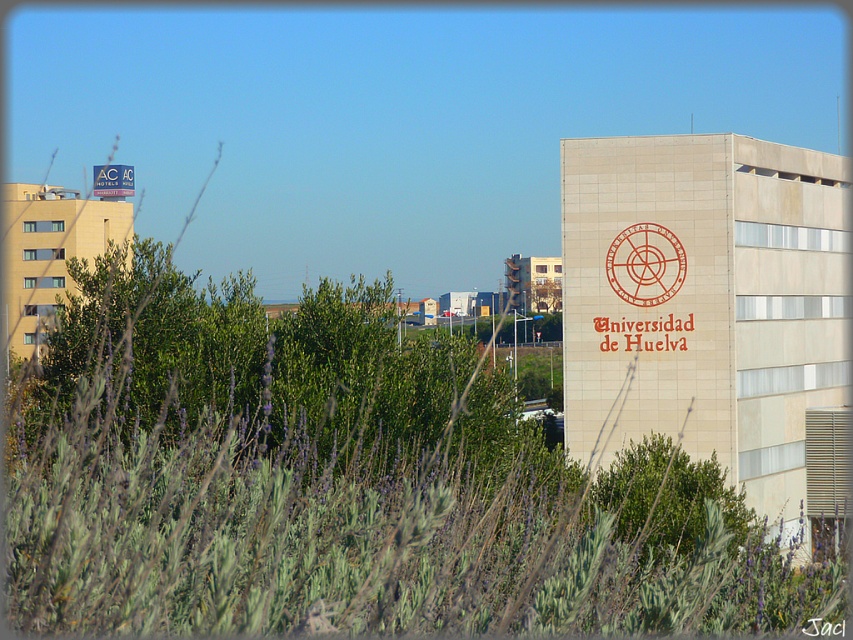
You are a visitor at the University of Huelva and need to locate the red rubber stamp at upper center and the matte red sign at upper left. Based on the scene description, which object is positioned more to the right side of the image?

The red rubber stamp at upper center is positioned more to the right side of the image compared to the matte red sign at upper left.

You are a visitor at the University of Huelva and want to locate the red rubber stamp at upper center and the matte red sign at upper left. Which object is positioned closer to you as you face the beige building?

The red rubber stamp at upper center is closer to the viewer than the matte red sign at upper left.